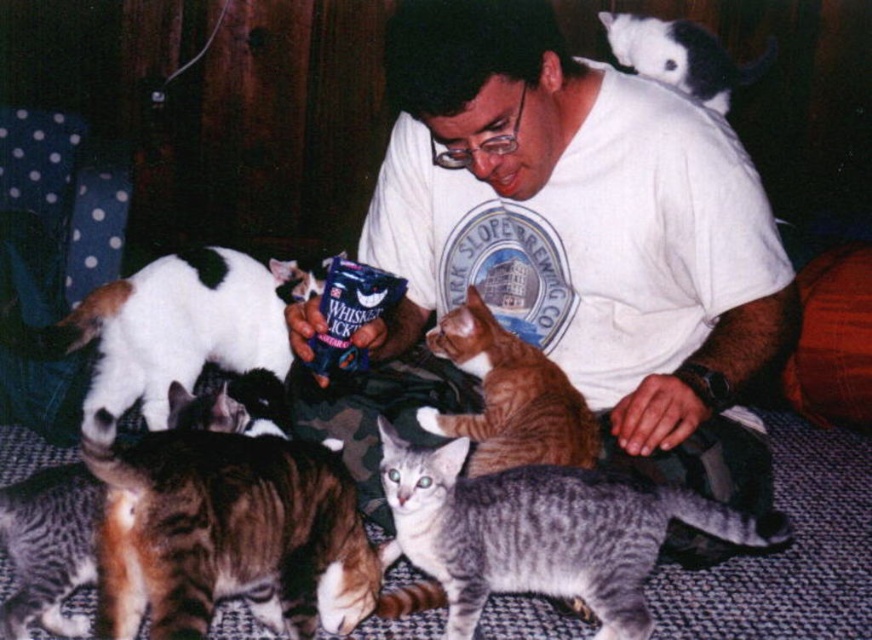
You are a photographer trying to capture the man and the cats in the scene. You notice two points marked in the image. Which point, point 1 at coordinates point (208,353) or point 2 at coordinates point (709,92), is closer to the camera lens?

Point 1 at coordinates point (208,353) is closer to the viewer than point 2 at coordinates point (709,92).

You are a photographer trying to capture a closeup of the blue Whiskas packet. You notice two points in the scene marked as point 1 at coordinates point (659, 365) and point 2 at coordinates point (295, 266). Which point should you focus on to ensure the Whiskas packet is in sharp focus?

Point 1 at coordinates point (659, 365) is closer to the camera than point 2 at coordinates point (295, 266), so focusing on point 1 will ensure the Whiskas packet is in sharp focus.